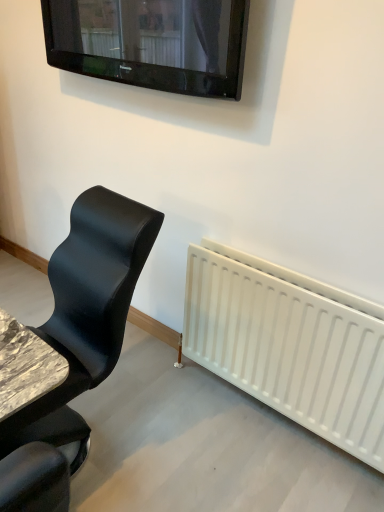
What do you see at coordinates (77, 343) in the screenshot? I see `black leather chair at left` at bounding box center [77, 343].

Where is `black leather chair at left`? This screenshot has height=512, width=384. black leather chair at left is located at coordinates (77, 343).

Locate an element on the screen. This screenshot has width=384, height=512. black glossy tv at upper center is located at coordinates (151, 42).

What do you see at coordinates (151, 42) in the screenshot? I see `black glossy tv at upper center` at bounding box center [151, 42].

I want to click on black leather chair at left, so click(77, 343).

Between black leather chair at left and black glossy tv at upper center, which one appears on the right side from the viewer's perspective?

black glossy tv at upper center.

Which object is further away from the camera, black leather chair at left or black glossy tv at upper center?

Positioned behind is black glossy tv at upper center.

Between point (77, 439) and point (98, 62), which one is positioned in front?

The point (77, 439) is more forward.

From the image's perspective, would you say black leather chair at left is shown under black glossy tv at upper center?

Correct, black leather chair at left appears lower than black glossy tv at upper center in the image.

From a real-world perspective, is black leather chair at left physically above black glossy tv at upper center?

No, from a real-world perspective, black leather chair at left is not over black glossy tv at upper center

Considering the relative sizes of black leather chair at left and black glossy tv at upper center in the image provided, is black leather chair at left thinner than black glossy tv at upper center?

In fact, black leather chair at left might be wider than black glossy tv at upper center.

In the scene shown: Considering the sizes of objects black leather chair at left and black glossy tv at upper center in the image provided, who is taller, black leather chair at left or black glossy tv at upper center?

With more height is black leather chair at left.

Who is smaller, black leather chair at left or black glossy tv at upper center?

Smaller between the two is black glossy tv at upper center.

Do you think black leather chair at left is within black glossy tv at upper center, or outside of it?

The correct answer is: outside.

Would you consider black leather chair at left to be distant from black glossy tv at upper center?

Indeed, black leather chair at left is not near black glossy tv at upper center.

Is black leather chair at left oriented away from black glossy tv at upper center?

That's not correct — black leather chair at left is not looking away from black glossy tv at upper center.

What's the angular difference between black leather chair at left and black glossy tv at upper center's facing directions?

7.75 degrees.

You are a GUI agent. You are given a task and a screenshot of the screen. Output one action in this format:
    pyautogui.click(x=<x>, y=<y>)
    Task: Click on the television behind the black leather chair at left
    The height and width of the screenshot is (512, 384).
    Given the screenshot: What is the action you would take?
    pyautogui.click(x=151, y=42)

Between black glossy tv at upper center and black leather chair at left, which one appears on the left side from the viewer's perspective?

Positioned to the left is black leather chair at left.

Relative to black leather chair at left, is black glossy tv at upper center in front or behind?

Visually, black glossy tv at upper center is located behind black leather chair at left.

Which is closer to the camera, (99, 73) or (36, 406)?

The point (36, 406) is closer.

From the image's perspective, relative to black leather chair at left, is black glossy tv at upper center above or below?

From the image's perspective, black glossy tv at upper center appears above black leather chair at left.

From a real-world perspective, which object stands above the other?

black glossy tv at upper center is physically above.

Considering the relative sizes of black glossy tv at upper center and black leather chair at left in the image provided, is black glossy tv at upper center thinner than black leather chair at left?

Correct, the width of black glossy tv at upper center is less than that of black leather chair at left.

Which of these two, black glossy tv at upper center or black leather chair at left, stands taller?

black leather chair at left.

Who is bigger, black glossy tv at upper center or black leather chair at left?

black leather chair at left is bigger.

Is black glossy tv at upper center located outside black leather chair at left?

Indeed, black glossy tv at upper center is completely outside black leather chair at left.

Would you say black glossy tv at upper center is a long distance from black leather chair at left?

That's right, there is a large distance between black glossy tv at upper center and black leather chair at left.

Does black glossy tv at upper center turn towards black leather chair at left?

No, black glossy tv at upper center is not turned towards black leather chair at left.

How distant is black glossy tv at upper center from black leather chair at left?

The distance of black glossy tv at upper center from black leather chair at left is 8.27 feet.

Find the location of a particular element. television that appears on the right of black leather chair at left is located at coordinates (151, 42).

The height and width of the screenshot is (512, 384). I want to click on television that appears above the black leather chair at left (from a real-world perspective), so click(x=151, y=42).

The width and height of the screenshot is (384, 512). Find the location of `chair on the left of black glossy tv at upper center`. chair on the left of black glossy tv at upper center is located at coordinates (77, 343).